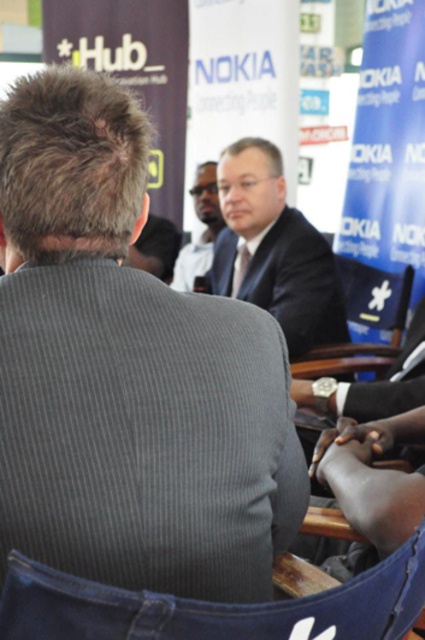
Question: In this image, where is gray ribbed shirt at center located relative to dark suit at center?

Choices:
 (A) right
 (B) left

Answer: (B)

Question: Does dark suit at center have a larger size compared to smooth skin face at center?

Choices:
 (A) no
 (B) yes

Answer: (B)

Question: Based on their relative distances, which object is farther from the dark suit at center?

Choices:
 (A) gray ribbed shirt at center
 (B) smooth skin face at center

Answer: (A)

Question: Which object is the farthest from the gray ribbed shirt at center?

Choices:
 (A) smooth skin face at center
 (B) dark suit at center

Answer: (A)

Question: Which point is farther to the camera?

Choices:
 (A) smooth skin face at center
 (B) gray ribbed shirt at center

Answer: (A)

Question: Is gray ribbed shirt at center to the left of dark suit at center from the viewer's perspective?

Choices:
 (A) no
 (B) yes

Answer: (B)